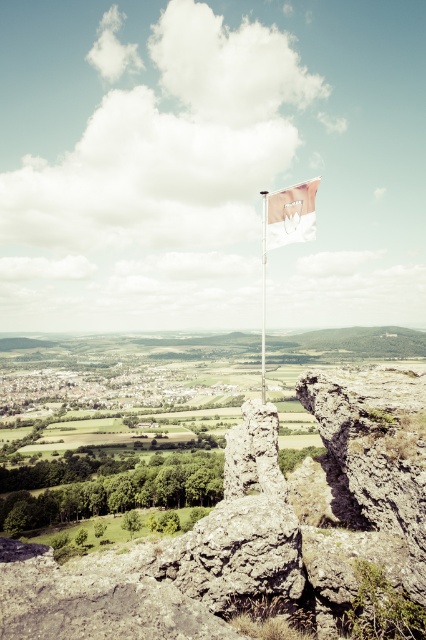
Is point (313, 566) positioned in front of point (261, 368)?

Yes, it is in front of point (261, 368).

Which is below, rugged stone cliff at center or metallic flag pole at center?

rugged stone cliff at center

Between point (252, 493) and point (264, 314), which one is positioned behind?

The point (264, 314) is behind.

Locate an element on the screen. This screenshot has width=426, height=640. rugged stone cliff at center is located at coordinates click(253, 528).

Does rugged stone cliff at center appear under white fabric flag at center?

Correct, rugged stone cliff at center is located below white fabric flag at center.

Between rugged stone cliff at center and white fabric flag at center, which one is positioned lower?

rugged stone cliff at center

At what (x,y) coordinates should I click in order to perform the action: click on rugged stone cliff at center. Please return your answer as a coordinate pair (x, y). Looking at the image, I should click on (253, 528).

This screenshot has height=640, width=426. What do you see at coordinates (290, 214) in the screenshot? I see `white fabric flag at center` at bounding box center [290, 214].

Measure the distance between white fabric flag at center and camera.

A distance of 107.81 feet exists between white fabric flag at center and camera.

The image size is (426, 640). Identify the location of white fabric flag at center. (290, 214).